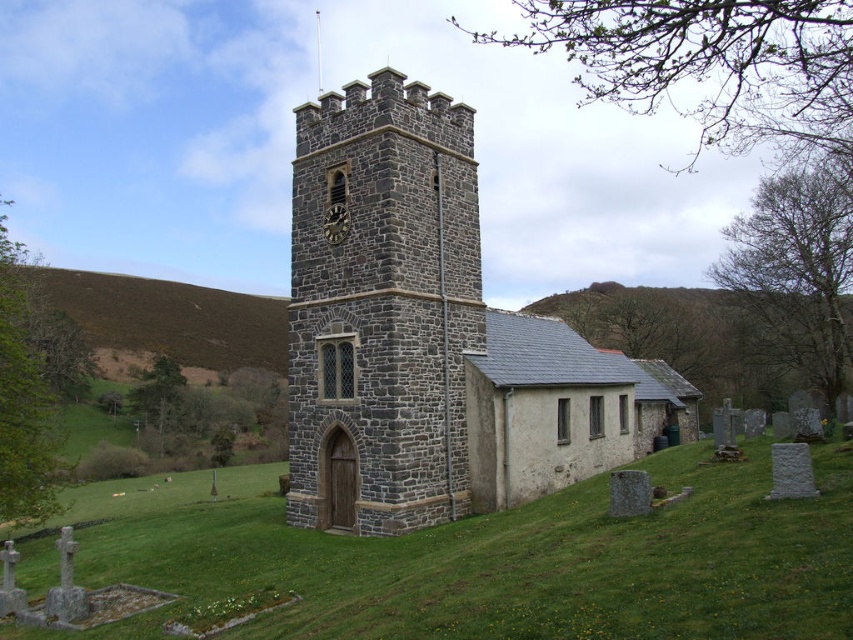
You are a visitor standing in front of the gray stone church at center and dark gray stone tower at center. Which structure appears taller from your perspective?

The gray stone church at center is much taller than the dark gray stone tower at center, so it appears taller from your perspective.

You are a photographer planning to take a wide shot of the gray stone church at center and the green grass at lower center. Which object should you focus on first if you want to ensure both are in sharp focus?

The gray stone church at center is larger in size than green grass at lower center, so focusing on the gray stone church at center first would help ensure both are in sharp focus.

You are a visitor standing in front of the gray stone church at center and dark gray stone tower at center. Which structure appears to have a larger width from your perspective?

The gray stone church at center might be wider than dark gray stone tower at center, so it likely appears wider from the visitor perspective.